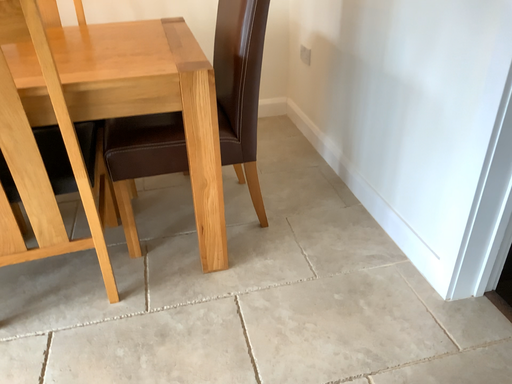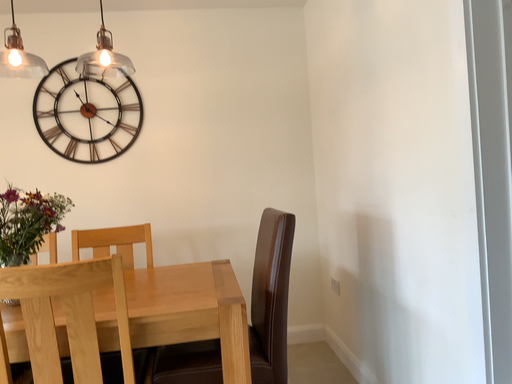
Question: How did the camera likely rotate when shooting the video?

Choices:
 (A) rotated left
 (B) rotated right

Answer: (A)